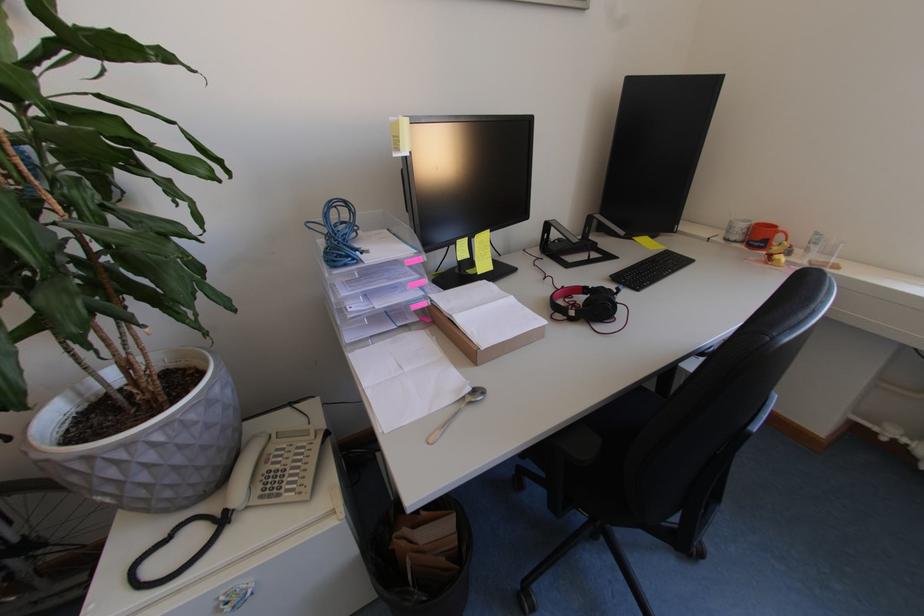
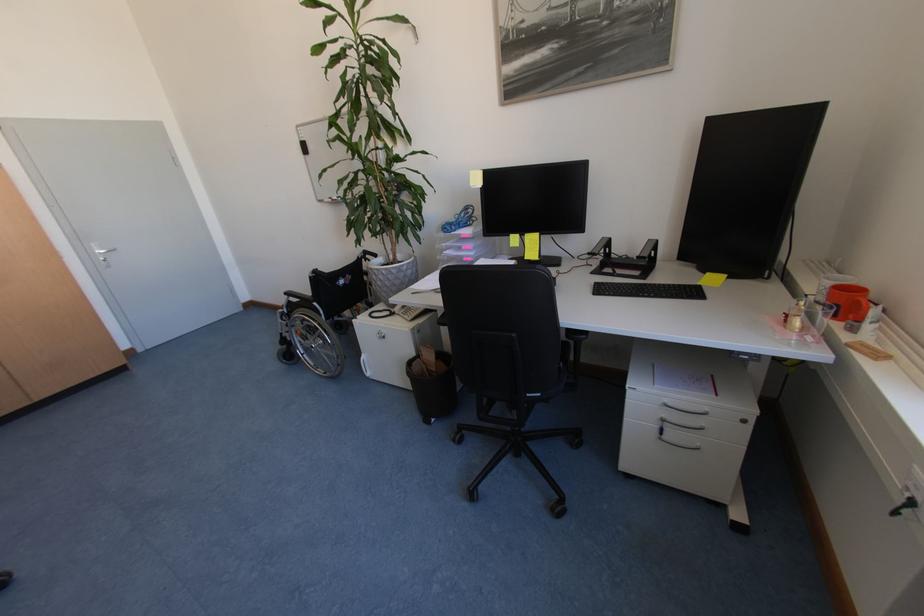
In the second image, find the point that corresponds to (x=742, y=240) in the first image.

(824, 300)